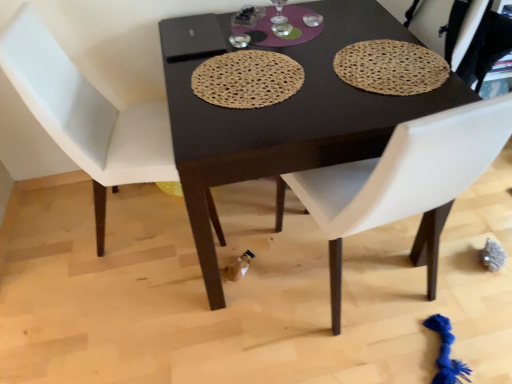
Question: From the image's perspective, is white leather chair at left, arranged as the 1th chair when viewed from the left, located above or below brown woven placemat at upper right, placed as the 1th mat when sorted from right to left?

Choices:
 (A) above
 (B) below

Answer: (B)

Question: From their relative heights in the image, would you say white leather chair at left, arranged as the 1th chair when viewed from the left, is taller or shorter than brown woven placemat at upper right, placed as the 1th mat when sorted from right to left?

Choices:
 (A) short
 (B) tall

Answer: (B)

Question: Which object is the closest to the brown woven placemat at upper right, the second mat viewed from the left?

Choices:
 (A) dark brown wood table at center
 (B) natural fiber placemat at center, the 1th mat when ordered from left to right
 (C) white leather chair at left, the 2th chair positioned from the right
 (D) white leather chair at center, the 1th chair in the right-to-left sequence

Answer: (A)

Question: Considering the real-world distances, which object is closest to the dark brown wood table at center?

Choices:
 (A) white leather chair at left, the 2th chair positioned from the right
 (B) brown woven placemat at upper right, placed as the 1th mat when sorted from right to left
 (C) natural fiber placemat at center, which appears as the second mat when viewed from the right
 (D) white leather chair at center, positioned as the second chair in left-to-right order

Answer: (C)